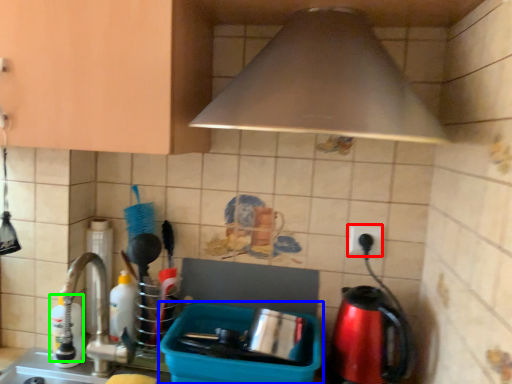
Question: Considering the real-world distances, which object is farthest from electric outlet (highlighted by a red box)? appliance (highlighted by a blue box) or bottle (highlighted by a green box)?

Choices:
 (A) appliance
 (B) bottle

Answer: (B)